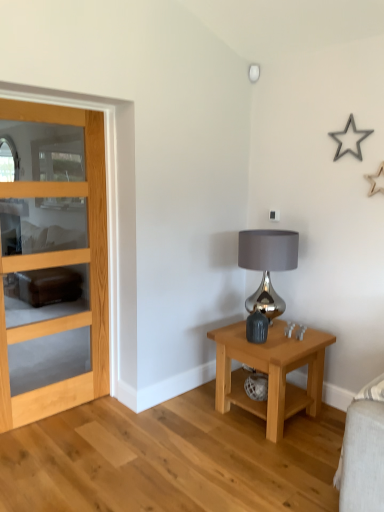
Where is `free spot above metallic gray lampshade at right (from a real-world perspective)`? free spot above metallic gray lampshade at right (from a real-world perspective) is located at coordinates (273, 232).